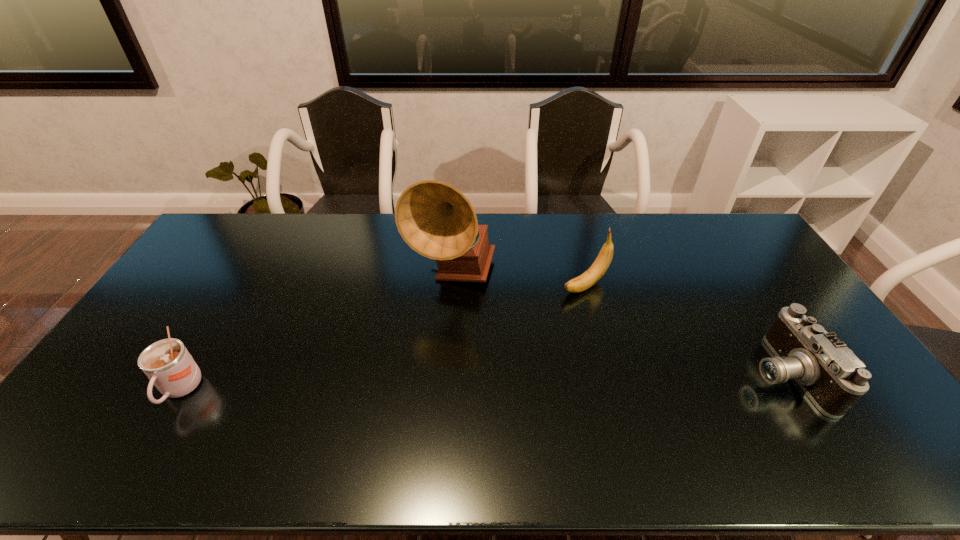
The image size is (960, 540). Find the location of `cup`. cup is located at coordinates (167, 363).

Image resolution: width=960 pixels, height=540 pixels. In order to click on the rightmost object in this screenshot , I will do `click(830, 374)`.

Find the location of `the second object from right to left`. the second object from right to left is located at coordinates (598, 268).

Locate an element on the screen. This screenshot has width=960, height=540. the third shortest object is located at coordinates (598, 268).

Identify the location of the second object from left to right. The width and height of the screenshot is (960, 540). (436, 220).

At what (x,y) coordinates should I click in order to perform the action: click on the tallest object. Please return your answer as a coordinate pair (x, y). This screenshot has width=960, height=540. Looking at the image, I should click on (436, 220).

Locate an element on the screen. Image resolution: width=960 pixels, height=540 pixels. free space located 0.250m at the lens of the rightmost object is located at coordinates (659, 373).

You are a GUI agent. You are given a task and a screenshot of the screen. Output one action in this format:
    pyautogui.click(x=<x>, y=<y>)
    Task: Click on the vacant area situated 0.110m at the lens of the rightmost object
    The width and height of the screenshot is (960, 540).
    Given the screenshot: What is the action you would take?
    pyautogui.click(x=709, y=373)

In order to click on vacant space positioned at the lens of the rightmost object in this screenshot , I will do `click(608, 373)`.

The image size is (960, 540). What are the coordinates of `vacant point located 0.390m at the start of the peel on the banana` in the screenshot? It's located at (471, 352).